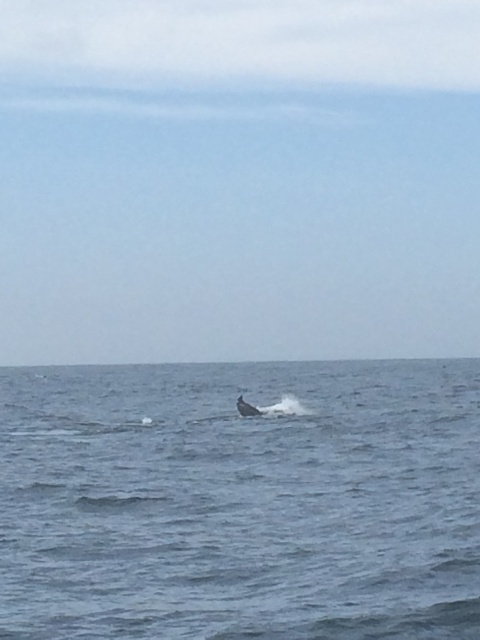
Can you confirm if blue water at center is taller than gray matte humpback whale at center?

Indeed, blue water at center has a greater height compared to gray matte humpback whale at center.

This screenshot has width=480, height=640. What do you see at coordinates (240, 500) in the screenshot?
I see `blue water at center` at bounding box center [240, 500].

Locate an element on the screen. Image resolution: width=480 pixels, height=640 pixels. blue water at center is located at coordinates point(240,500).